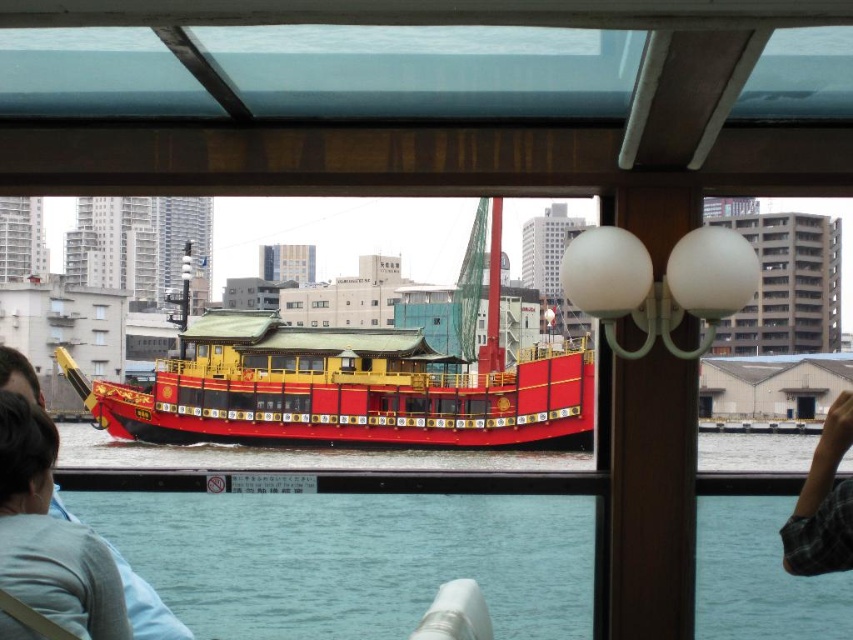
Question: Among these objects, which one is nearest to the camera?

Choices:
 (A) light blue shirt at lower left
 (B) plaid fabric sleeve at lower right

Answer: (A)

Question: Which object is positioned farthest from the light blue shirt at lower left?

Choices:
 (A) shiny red boat at center
 (B) transparent glass window at center

Answer: (B)

Question: Does light blue shirt at lower left appear over transparent glass window at center?

Choices:
 (A) yes
 (B) no

Answer: (B)

Question: From the image, what is the correct spatial relationship of clear water at lower center in relation to shiny red boat at center?

Choices:
 (A) left
 (B) right

Answer: (B)

Question: Does shiny red boat at center have a smaller size compared to transparent glass window at center?

Choices:
 (A) no
 (B) yes

Answer: (A)

Question: Which object is the closest to the transparent glass window at center?

Choices:
 (A) plaid fabric sleeve at lower right
 (B) light blue shirt at lower left

Answer: (B)